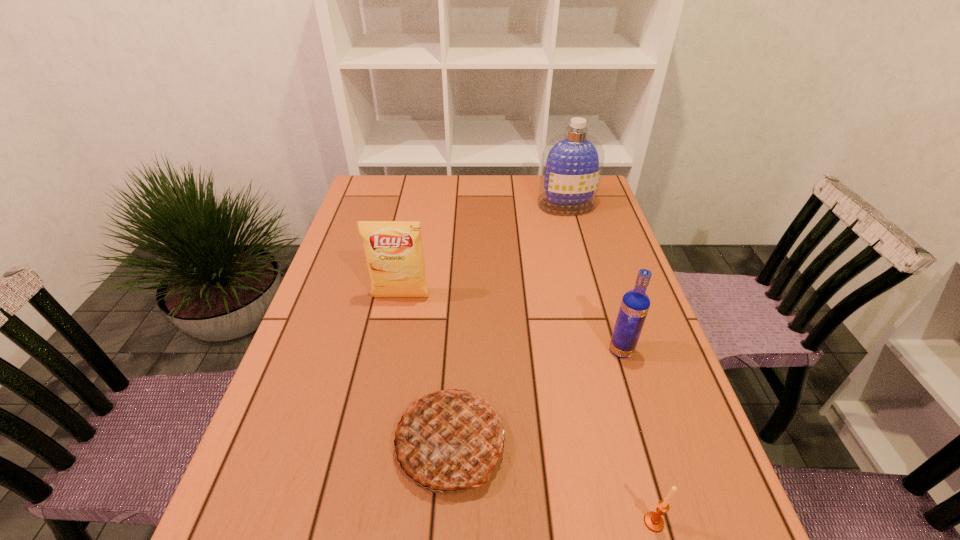
Image resolution: width=960 pixels, height=540 pixels. Identify the location of free space between the crisp (potato chip) and the pie. (425, 370).

The height and width of the screenshot is (540, 960). I want to click on free space that is in between the cleansing agent and the vodka, so click(593, 278).

Where is `blank region between the fourth tallest object and the candle_holder`? Image resolution: width=960 pixels, height=540 pixels. blank region between the fourth tallest object and the candle_holder is located at coordinates (552, 483).

At what (x,y) coordinates should I click in order to perform the action: click on vacant space in between the second farthest object and the pie. Please return your answer as a coordinate pair (x, y). This screenshot has height=540, width=960. Looking at the image, I should click on (425, 370).

Select which object is the fourth closest to the farthest object. Please provide its 2D coordinates. Your answer should be formatted as a tuple, i.e. [(x, y)], where the tuple contains the x and y coordinates of a point satisfying the conditions above.

[(654, 522)]

Identify which object is located as the third nearest to the crisp (potato chip). Please provide its 2D coordinates. Your answer should be formatted as a tuple, i.e. [(x, y)], where the tuple contains the x and y coordinates of a point satisfying the conditions above.

[(572, 162)]

Where is `vacant space that satisfies the following two spatial constraints: 1. on the front of the candle_holder with the logo; 2. on the right side of the crisp (potato chip)`? vacant space that satisfies the following two spatial constraints: 1. on the front of the candle_holder with the logo; 2. on the right side of the crisp (potato chip) is located at coordinates (357, 522).

Locate an element on the screen. Image resolution: width=960 pixels, height=540 pixels. blank space that satisfies the following two spatial constraints: 1. on the front side of the candle_holder; 2. on the right side of the second shortest object is located at coordinates (446, 522).

The height and width of the screenshot is (540, 960). Identify the location of vacant position in the image that satisfies the following two spatial constraints: 1. on the front of the second farthest object with the logo; 2. on the left side of the fourth farthest object. (372, 444).